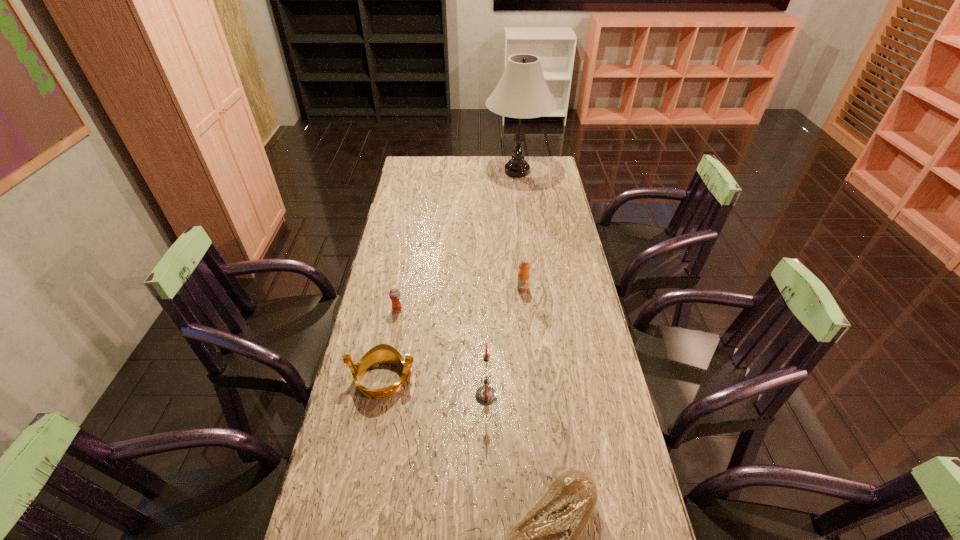
You are a GUI agent. You are given a task and a screenshot of the screen. Output one action in this format:
    pyautogui.click(x=<x>, y=<y>)
    Task: Click on the vacant area situated 0.100m on the front-facing side of the candle
    This screenshot has width=960, height=540.
    Given the screenshot: What is the action you would take?
    pyautogui.click(x=440, y=396)

Identify the location of vacant space situated 0.210m on the front-facing side of the candle. (401, 396).

Identify the location of vacant space located 0.270m on the front label of the second farthest object. The image size is (960, 540). (529, 354).

Locate an element on the screen. This screenshot has height=540, width=960. vacant region located 0.080m at the front emblem of the tiara is located at coordinates (444, 379).

Locate an element on the screen. This screenshot has height=540, width=960. free space located 0.080m on the front of the left orange juice is located at coordinates (393, 332).

Identify the location of object present at the far edge. (522, 92).

This screenshot has height=540, width=960. I want to click on tiara at the left edge, so click(383, 353).

This screenshot has height=540, width=960. I want to click on orange juice that is at the left edge, so click(x=394, y=294).

Locate an element on the screen. The width and height of the screenshot is (960, 540). object that is at the right edge is located at coordinates (522, 92).

You are a GUI agent. You are given a task and a screenshot of the screen. Output one action in this format:
    pyautogui.click(x=<x>, y=<y>)
    Task: Click on the object that is at the far right corner
    The image size is (960, 540).
    Given the screenshot: What is the action you would take?
    pyautogui.click(x=522, y=92)